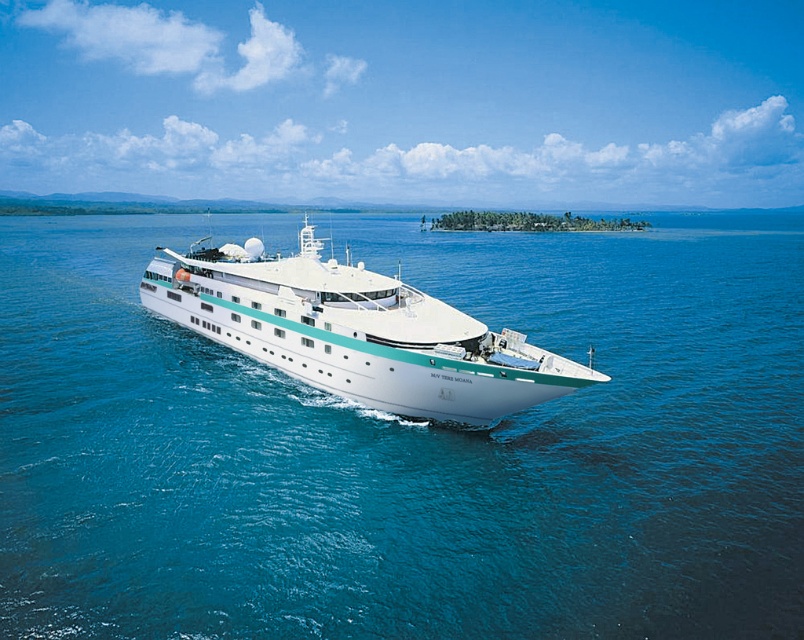
Question: Which object is closer to the camera taking this photo?

Choices:
 (A) white glossy cruise ship at center
 (B) blue water at center

Answer: (B)

Question: Among these objects, which one is farthest from the camera?

Choices:
 (A) blue water at center
 (B) white glossy cruise ship at center

Answer: (B)

Question: Is blue water at center thinner than white glossy cruise ship at center?

Choices:
 (A) no
 (B) yes

Answer: (A)

Question: Does blue water at center appear under white glossy cruise ship at center?

Choices:
 (A) yes
 (B) no

Answer: (A)

Question: Which object is closer to the camera taking this photo?

Choices:
 (A) white glossy cruise ship at center
 (B) blue water at center

Answer: (B)

Question: Can you confirm if blue water at center is positioned to the left of white glossy cruise ship at center?

Choices:
 (A) yes
 (B) no

Answer: (A)